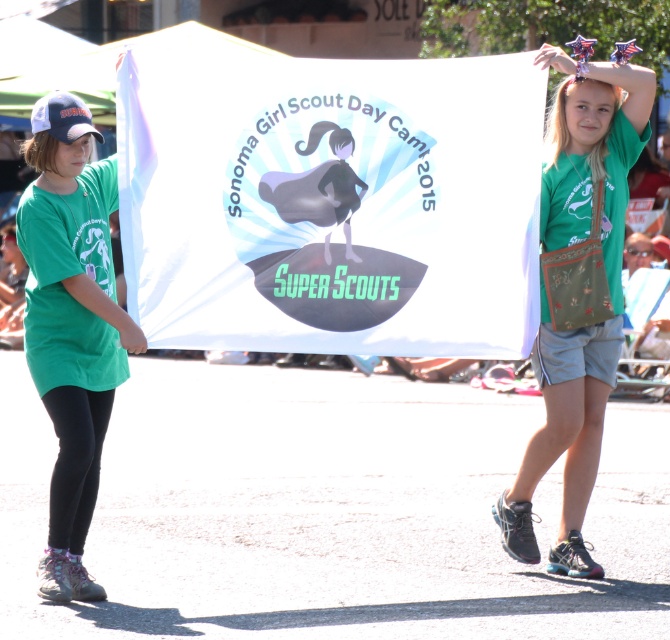
Measure the distance between green fabric shirt at left and camera.

green fabric shirt at left and camera are 7.20 meters apart.

Does green fabric shirt at left have a greater width compared to green fabric purse at center?

In fact, green fabric shirt at left might be narrower than green fabric purse at center.

This screenshot has height=640, width=670. Find the location of `green fabric shirt at left`. green fabric shirt at left is located at coordinates (70, 323).